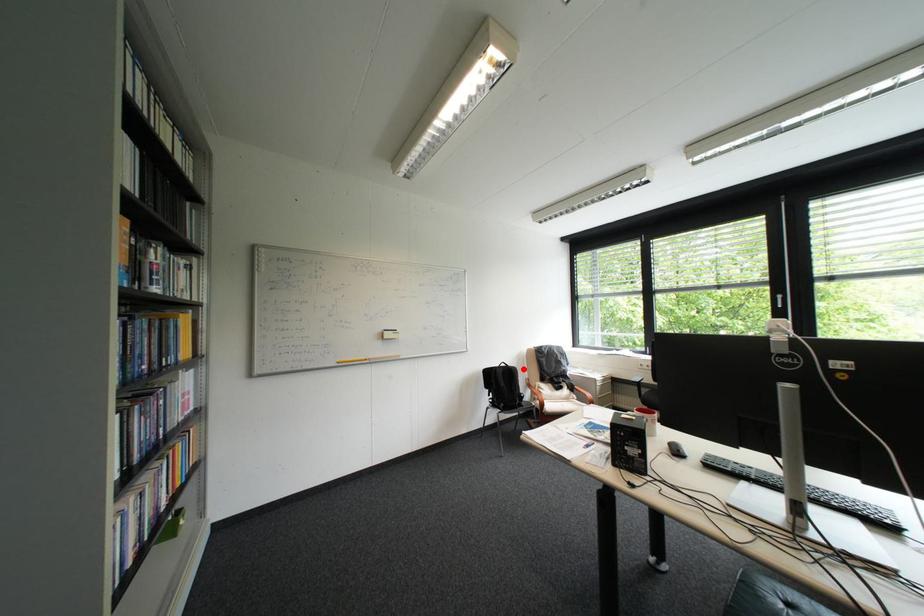
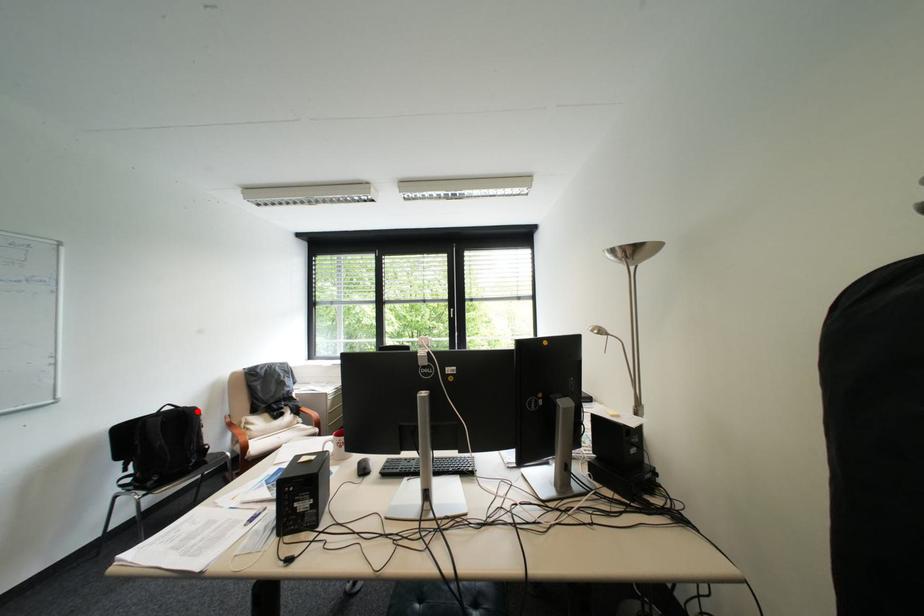
I am providing you with two images of the same scene from different viewpoints. A red point is marked on the first image and another point is marked on the second image. Are the points marked in image1 and image2 representing the same 3D position?

Yes